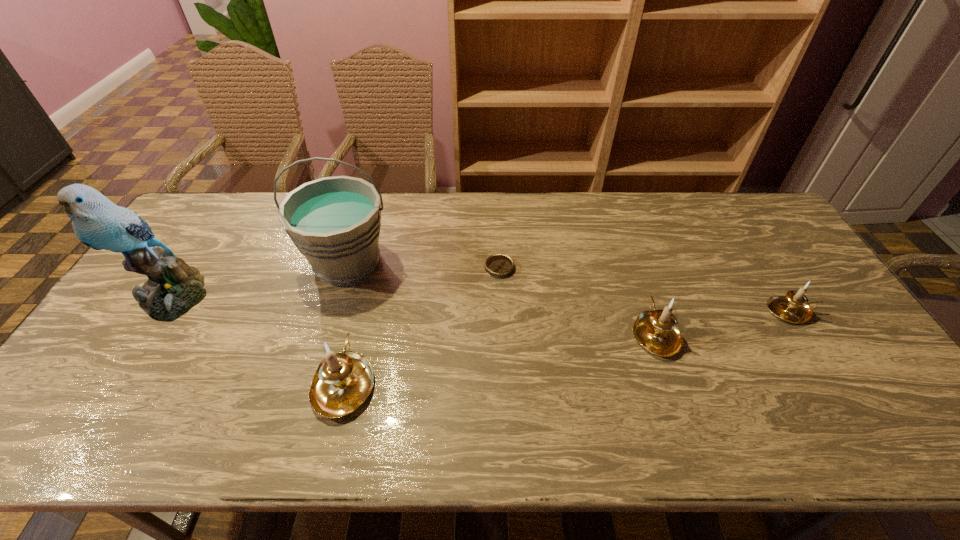
Find the location of a particular element. The height and width of the screenshot is (540, 960). free point located on the handle side of the fourth shortest object is located at coordinates (367, 290).

Where is `vacant space located 0.070m on the handle side of the fourth shortest object`? The image size is (960, 540). vacant space located 0.070m on the handle side of the fourth shortest object is located at coordinates click(358, 325).

At what (x,y) coordinates should I click in order to perform the action: click on vacant area located on the handle side of the fourth shortest object. Please return your answer as a coordinate pair (x, y). Looking at the image, I should click on (362, 308).

Find the location of a particular element. The width and height of the screenshot is (960, 540). vacant space situated 0.300m on the handle side of the second candle holder from left to right is located at coordinates (623, 238).

At what (x,y) coordinates should I click in order to perform the action: click on blank space located on the handle side of the second candle holder from left to right. Please return your answer as a coordinate pair (x, y). The image size is (960, 540). Looking at the image, I should click on (626, 246).

Identify the location of free space located on the handle side of the second candle holder from left to right. This screenshot has height=540, width=960. (637, 282).

Locate an element on the screen. This screenshot has width=960, height=540. free space located 0.210m on the face of the parakeet is located at coordinates (108, 396).

Where is `vacant region located on the front of the bucket`? The image size is (960, 540). vacant region located on the front of the bucket is located at coordinates (325, 335).

This screenshot has height=540, width=960. In order to click on free spot located on the left of the third object from right to left in this screenshot , I will do `click(442, 268)`.

This screenshot has width=960, height=540. Find the location of `object positioned at the far edge`. object positioned at the far edge is located at coordinates (335, 222).